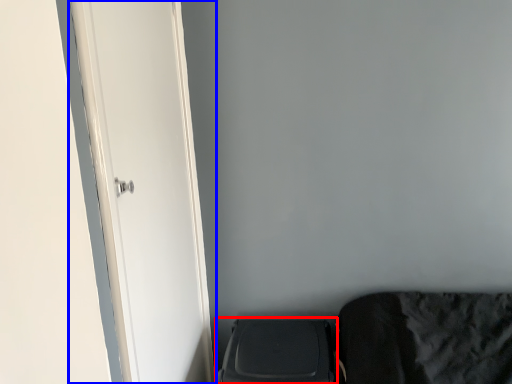
Question: Which object is further to the camera taking this photo, appliance (highlighted by a red box) or door (highlighted by a blue box)?

Choices:
 (A) appliance
 (B) door

Answer: (A)